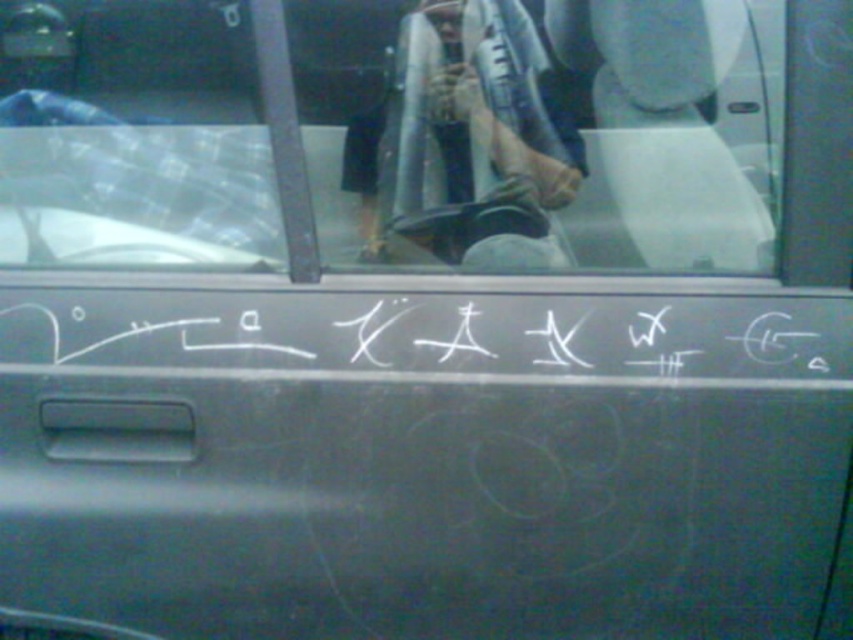
Question: Among these objects, which one is farthest from the camera?

Choices:
 (A) transparent glass windshield at upper center
 (B) white chalk writing at center

Answer: (B)

Question: Which point is farther from the camera taking this photo?

Choices:
 (A) (585, 333)
 (B) (751, 257)

Answer: (B)

Question: From the image, what is the correct spatial relationship of transparent glass windshield at upper center in relation to white chalk writing at center?

Choices:
 (A) right
 (B) left

Answer: (B)

Question: Observing the image, what is the correct spatial positioning of transparent glass windshield at upper center in reference to white chalk writing at center?

Choices:
 (A) left
 (B) right

Answer: (A)

Question: Does transparent glass windshield at upper center appear on the left side of white chalk writing at center?

Choices:
 (A) yes
 (B) no

Answer: (A)